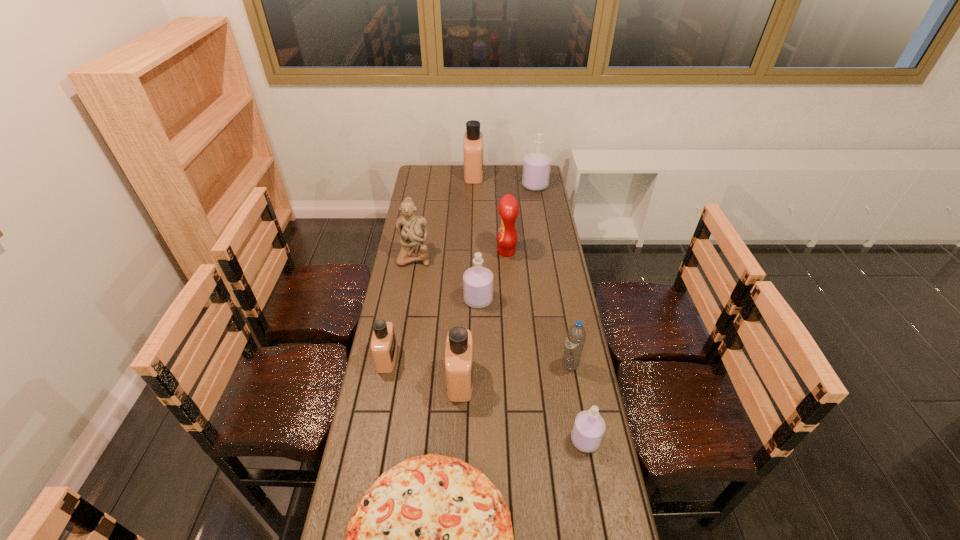
I want to click on vacant space located 0.310m on the left of the water bottle, so click(x=472, y=365).

The height and width of the screenshot is (540, 960). In order to click on vacant space situated 0.070m on the left of the nearest perfume in this screenshot , I will do [548, 440].

You are a GUI agent. You are given a task and a screenshot of the screen. Output one action in this format:
    pyautogui.click(x=<x>, y=<y>)
    Task: Click on the free space located on the front label of the leftmost beige perfume
    This screenshot has height=540, width=960.
    Given the screenshot: What is the action you would take?
    pyautogui.click(x=424, y=358)

The image size is (960, 540). Find the location of `figurine that is at the left edge`. figurine that is at the left edge is located at coordinates (412, 230).

Identify the location of perfume located at the left edge. This screenshot has width=960, height=540. (383, 343).

The width and height of the screenshot is (960, 540). In order to click on water bottle present at the right edge in this screenshot , I will do `click(576, 335)`.

Where is `object that is at the far right corner`? This screenshot has height=540, width=960. object that is at the far right corner is located at coordinates (536, 166).

Where is `vacant space at the far edge of the desktop`? vacant space at the far edge of the desktop is located at coordinates (497, 168).

In the image, there is a desktop. At what (x,y) coordinates should I click in order to perform the action: click on vacant region at the left edge. Please return your answer as a coordinate pair (x, y). Looking at the image, I should click on (427, 207).

This screenshot has width=960, height=540. In order to click on free region at the right edge in this screenshot , I will do `click(552, 274)`.